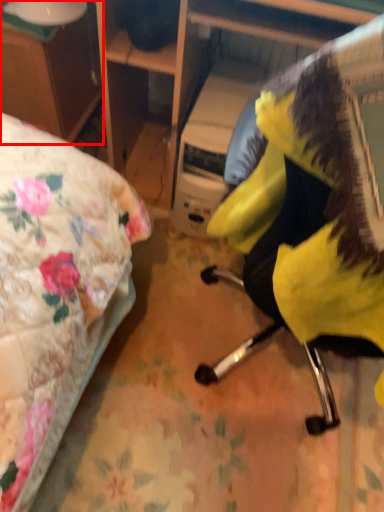
Question: From the image's perspective, what is the correct spatial relationship of desk (annotated by the red box) in relation to chair?

Choices:
 (A) below
 (B) above

Answer: (B)